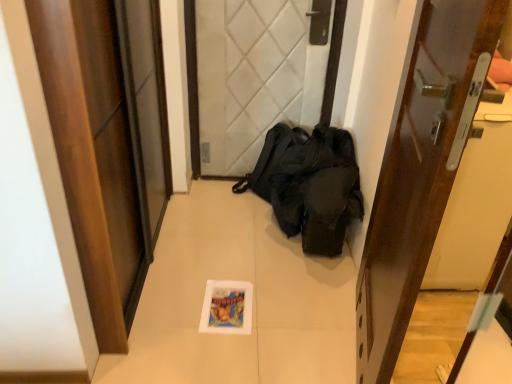
This screenshot has height=384, width=512. I want to click on free space that is in between white quilted fabric at center, which is the second door in left-to-right order, and wooden glossy door at right, the 1th door positioned from the right, so click(x=272, y=258).